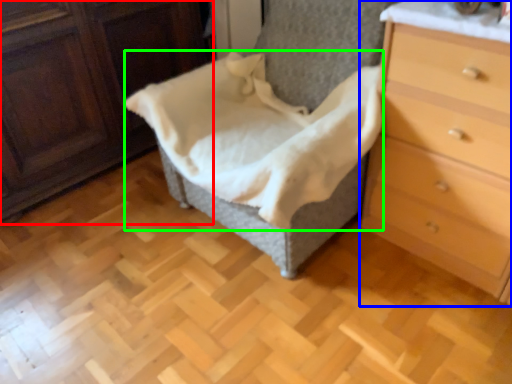
Question: Which is farther away from furniture (highlighted by a red box)? chest of drawers (highlighted by a blue box) or blanket (highlighted by a green box)?

Choices:
 (A) chest of drawers
 (B) blanket

Answer: (A)